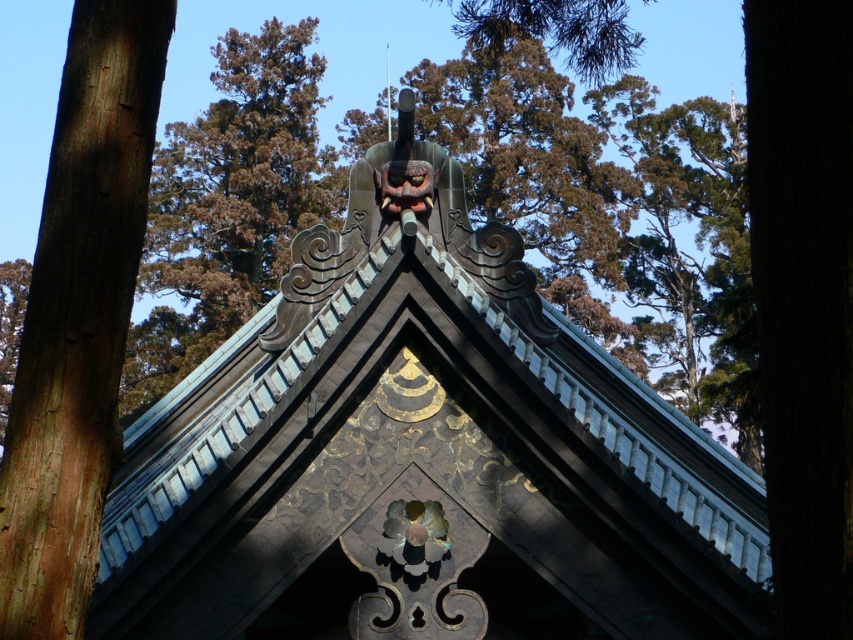
Question: Which object is positioned closest to the brown wood tree at upper center?

Choices:
 (A) brown rough wood at left
 (B) dark brown wood at right

Answer: (B)

Question: From the image, what is the correct spatial relationship of brown rough wood at left in relation to brown wood tree at upper center?

Choices:
 (A) right
 (B) left

Answer: (A)

Question: Which point appears closest to the camera in this image?

Choices:
 (A) (838, 296)
 (B) (257, 198)
 (C) (67, 180)

Answer: (A)

Question: Does dark brown wood at right have a greater width compared to brown wood tree at upper center?

Choices:
 (A) yes
 (B) no

Answer: (B)

Question: Can you confirm if brown rough wood at left is positioned to the left of brown wood tree at upper center?

Choices:
 (A) yes
 (B) no

Answer: (B)

Question: Among these points, which one is farthest from the camera?

Choices:
 (A) (747, 44)
 (B) (144, 278)
 (C) (79, 145)

Answer: (B)